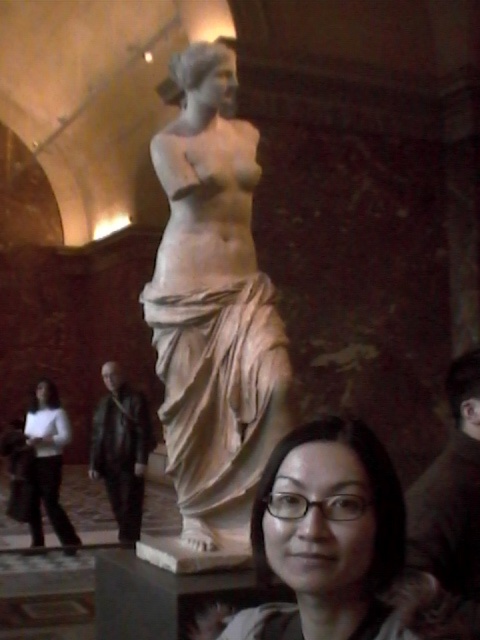
You are a photographer trying to capture the white marble statue at center and the white matte pants at lower left in the same frame. Based on their positions, which object should you focus on first to ensure both are in focus?

The white marble statue at center is closer to the viewer than the white matte pants at lower left. To ensure both are in focus, you should focus on the white marble statue at center first, as focusing on the closer object allows the background object to be in focus as well within the depth of field.

You are a visitor in the museum and want to take a photo of the matte white statue at center without any people in the background. The white matte pants at lower left belong to a person standing nearby. Can you take the photo as desired?

The matte white statue at center is in front of the white matte pants at lower left, so the statue will block the person wearing the pants from the background. You can take the photo as desired.

You are an art student trying to sketch the statue. You have a sketchbook that can only accommodate objects up to the width of the white matte pants at lower left. Will the matte white statue at center fit in your sketchbook?

The matte white statue at center has a lesser width compared to white matte pants at lower left, so yes, the statue will fit in the sketchbook since it is narrower than the pants.